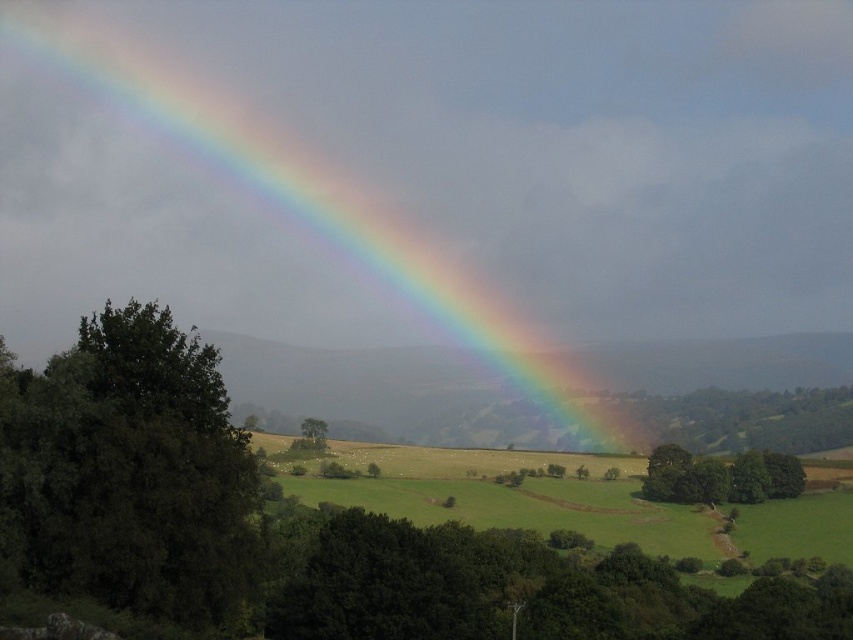
You are standing at the origin point in this rural landscape. You see two points marked in the scene. Which point is closer to you, point (450, 216) or point (642, 483)?

Point (642, 483) is closer to you because it is in front of point (450, 216).

Looking at this image, you are a landscape photographer planning to capture the entire view of the green grassy field at center and the green leafy trees at lower right in a single shot. Based on the scene, which object occupies more horizontal space in the image?

The green grassy field at center occupies more horizontal space than the green leafy trees at lower right because its width surpasses theirs according to the description.

You are an artist planning to paint this landscape. You want to ensure the rainbow at upper left and green leafy trees at lower right are proportionally accurate. Which object should you make wider in your painting?

The rainbow at upper left should be made wider in the painting since its width is larger than the green leafy trees at lower right according to the description.